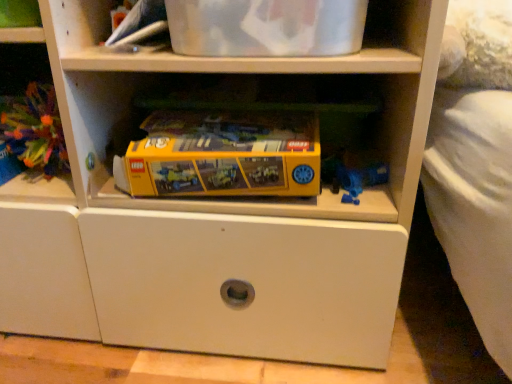
Question: In which direction should I rotate to look at yellow plastic lego set at center, the 1th toy when ordered from right to left?

Choices:
 (A) left
 (B) right

Answer: (A)

Question: Can you confirm if multicolored plastic toy at left, placed as the 1th toy when sorted from left to right, is wider than yellow plastic lego set at center, the 1th toy when ordered from right to left?

Choices:
 (A) no
 (B) yes

Answer: (A)

Question: Does multicolored plastic toy at left, placed as the 1th toy when sorted from left to right, have a lesser width compared to yellow plastic lego set at center, the 1th toy when ordered from right to left?

Choices:
 (A) no
 (B) yes

Answer: (B)

Question: From a real-world perspective, is multicolored plastic toy at left, which is the second toy in right-to-left order, on yellow plastic lego set at center, which appears as the 2th toy when viewed from the left?

Choices:
 (A) yes
 (B) no

Answer: (A)

Question: Does multicolored plastic toy at left, which is the second toy in right-to-left order, have a smaller size compared to yellow plastic lego set at center, which appears as the 2th toy when viewed from the left?

Choices:
 (A) yes
 (B) no

Answer: (A)

Question: Is multicolored plastic toy at left, which is the second toy in right-to-left order, at the left side of yellow plastic lego set at center, which appears as the 2th toy when viewed from the left?

Choices:
 (A) yes
 (B) no

Answer: (A)

Question: From a real-world perspective, is multicolored plastic toy at left, which is the second toy in right-to-left order, under yellow plastic lego set at center, which appears as the 2th toy when viewed from the left?

Choices:
 (A) no
 (B) yes

Answer: (A)

Question: Can you confirm if yellow plastic lego set at center, which appears as the 2th toy when viewed from the left, is shorter than multicolored plastic toy at left, which is the second toy in right-to-left order?

Choices:
 (A) no
 (B) yes

Answer: (B)

Question: Is yellow plastic lego set at center, the 1th toy when ordered from right to left, outside of multicolored plastic toy at left, placed as the 1th toy when sorted from left to right?

Choices:
 (A) yes
 (B) no

Answer: (A)

Question: Is yellow plastic lego set at center, which appears as the 2th toy when viewed from the left, positioned before multicolored plastic toy at left, placed as the 1th toy when sorted from left to right?

Choices:
 (A) yes
 (B) no

Answer: (A)

Question: Could you tell me if yellow plastic lego set at center, the 1th toy when ordered from right to left, is facing multicolored plastic toy at left, placed as the 1th toy when sorted from left to right?

Choices:
 (A) no
 (B) yes

Answer: (A)

Question: Is multicolored plastic toy at left, placed as the 1th toy when sorted from left to right, at the back of yellow plastic lego set at center, the 1th toy when ordered from right to left?

Choices:
 (A) no
 (B) yes

Answer: (A)

Question: Are yellow plastic lego set at center, which appears as the 2th toy when viewed from the left, and multicolored plastic toy at left, which is the second toy in right-to-left order, located far from each other?

Choices:
 (A) yes
 (B) no

Answer: (B)

Question: Considering the relative positions of yellow plastic lego set at center, which appears as the 2th toy when viewed from the left, and multicolored plastic toy at left, placed as the 1th toy when sorted from left to right, in the image provided, is yellow plastic lego set at center, which appears as the 2th toy when viewed from the left, to the left or to the right of multicolored plastic toy at left, placed as the 1th toy when sorted from left to right,?

Choices:
 (A) right
 (B) left

Answer: (A)